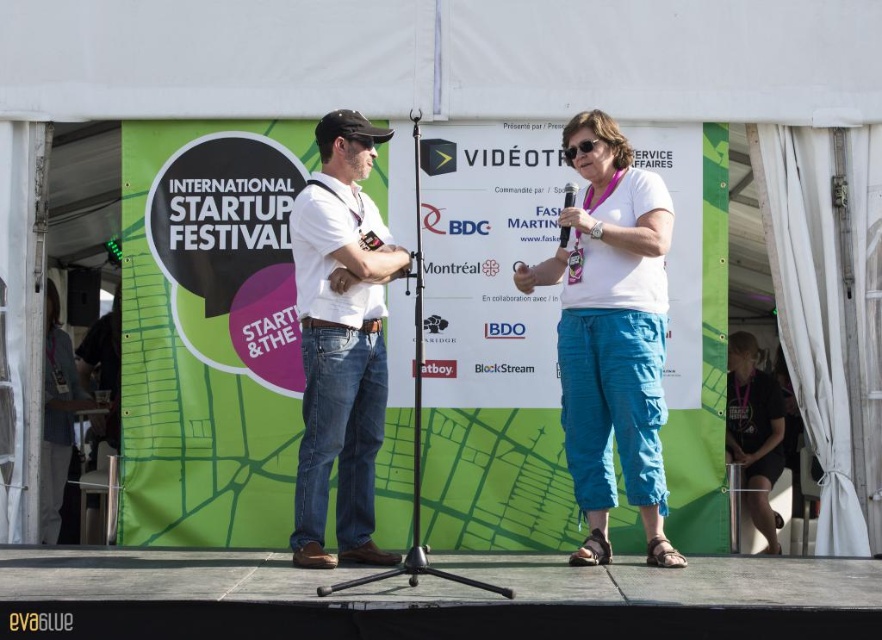
You are a photographer at the International Startup Festival. You need to capture a photo where both the white cotton shirt at center and the black plastic microphone at center are clearly visible. Given their sizes, which object will appear bigger in the photo?

The white cotton shirt at center will appear bigger in the photo because it is larger in size than the black plastic microphone at center.

You are a photographer at the International Startup Festival. You need to capture a photo that includes both the white cotton shirt at center and the black plastic microphone at center. Based on their positions, which object should you adjust your camera angle to focus on first to ensure both are in frame?

The white cotton shirt at center is positioned on the left side of the black plastic microphone at center. To ensure both are in frame, focus on the white cotton shirt at center first, then adjust the angle to include the black plastic microphone at center on the right.